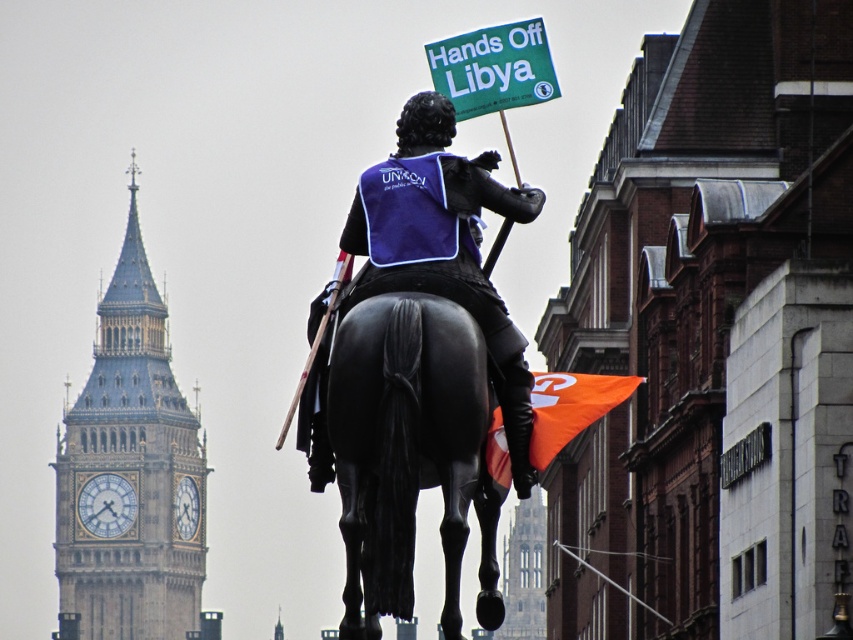
Is the position of stone clock tower at left more distant than that of black polished horse at center?

Yes, stone clock tower at left is behind black polished horse at center.

Can you confirm if stone clock tower at left is smaller than black polished horse at center?

Incorrect, stone clock tower at left is not smaller in size than black polished horse at center.

Is point (120, 387) positioned behind point (454, 449)?

Yes, point (120, 387) is farther from viewer.

This screenshot has height=640, width=853. In order to click on stone clock tower at left in this screenshot , I will do `click(131, 474)`.

Can you confirm if green paper sign at upper center is thinner than orange fabric flag at lower right?

Yes, green paper sign at upper center is thinner than orange fabric flag at lower right.

Is the position of green paper sign at upper center more distant than that of orange fabric flag at lower right?

Yes, green paper sign at upper center is behind orange fabric flag at lower right.

Is point (514, 40) closer to viewer compared to point (535, 404)?

That is False.

Identify the location of green paper sign at upper center. The width and height of the screenshot is (853, 640). (492, 67).

Is stone clock tower at left taller than shiny black statue at center?

Indeed, stone clock tower at left has a greater height compared to shiny black statue at center.

Between stone clock tower at left and shiny black statue at center, which one has less height?

With less height is shiny black statue at center.

Which is in front, point (76, 506) or point (380, 179)?

Point (380, 179) is in front.

Find the location of a particular element. stone clock tower at left is located at coordinates (131, 474).